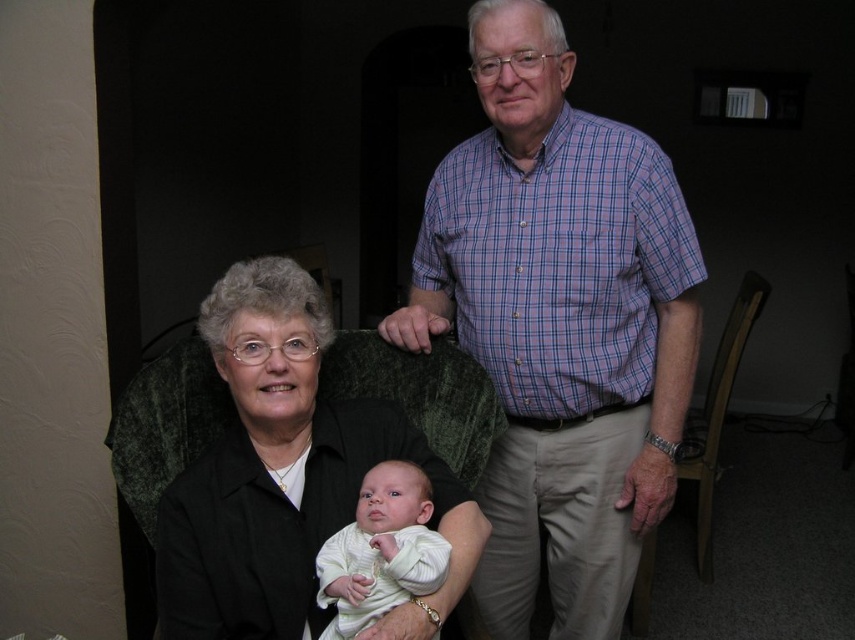
Question: Is plaid cotton shirt at center closer to camera compared to black fabric at center?

Choices:
 (A) yes
 (B) no

Answer: (B)

Question: Estimate the real-world distances between objects in this image. Which object is farther from the black fabric at center?

Choices:
 (A) white soft fabric baby at center
 (B) plaid cotton shirt at center

Answer: (B)

Question: Is the position of plaid cotton shirt at center more distant than that of white soft fabric baby at center?

Choices:
 (A) yes
 (B) no

Answer: (A)

Question: Which of the following is the farthest from the observer?

Choices:
 (A) plaid cotton shirt at center
 (B) black fabric at center
 (C) white soft fabric baby at center

Answer: (A)

Question: Observing the image, what is the correct spatial positioning of plaid cotton shirt at center in reference to white soft fabric baby at center?

Choices:
 (A) below
 (B) above

Answer: (B)

Question: Which is nearer to the plaid cotton shirt at center?

Choices:
 (A) white soft fabric baby at center
 (B) black fabric at center

Answer: (B)